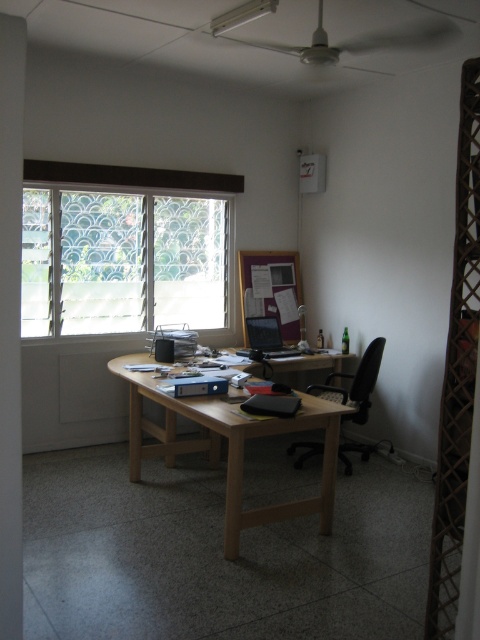
Does black mesh office chair at center appear over satin black laptop at center?

Actually, black mesh office chair at center is below satin black laptop at center.

Does black mesh office chair at center have a greater width compared to satin black laptop at center?

Correct, the width of black mesh office chair at center exceeds that of satin black laptop at center.

Is point (343, 452) positioned in front of point (271, 333)?

Yes.

The image size is (480, 640). In order to click on black mesh office chair at center in this screenshot , I will do `click(355, 385)`.

Looking at this image, is light wood/wooden computer desk at center bigger than black mesh office chair at center?

Yes.

Consider the image. Who is higher up, light wood/wooden computer desk at center or black mesh office chair at center?

Positioned higher is black mesh office chair at center.

Is point (228, 536) positioned behind point (321, 444)?

No, (228, 536) is closer to viewer.

In order to click on light wood/wooden computer desk at center in this screenshot , I will do `click(228, 445)`.

Which is in front, point (142, 321) or point (256, 321)?

Point (142, 321) is more forward.

Can you confirm if clear glass window at upper left is positioned below satin black laptop at center?

No.

Which is in front, point (187, 316) or point (248, 317)?

Positioned in front is point (248, 317).

Image resolution: width=480 pixels, height=640 pixels. In order to click on clear glass window at upper left in this screenshot , I will do `click(123, 248)`.